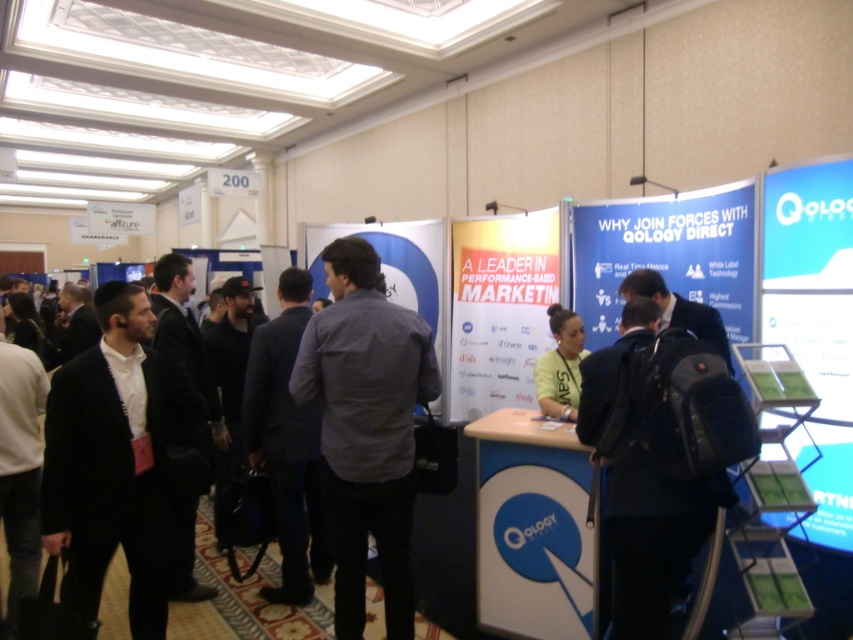
From the picture: You are at the Qology Direct booth and need to locate the gray cotton shirt at center. What are the coordinates where you can find it?

The gray cotton shirt at center can be found at coordinates point (366, 428).

You are attending a conference and want to approach the Qology Direct booth. You see a gray cotton shirt at center and a black matte suit at left. Which person should you approach first?

You should approach the gray cotton shirt at center first because it is closer to you than the black matte suit at left, which is further away.